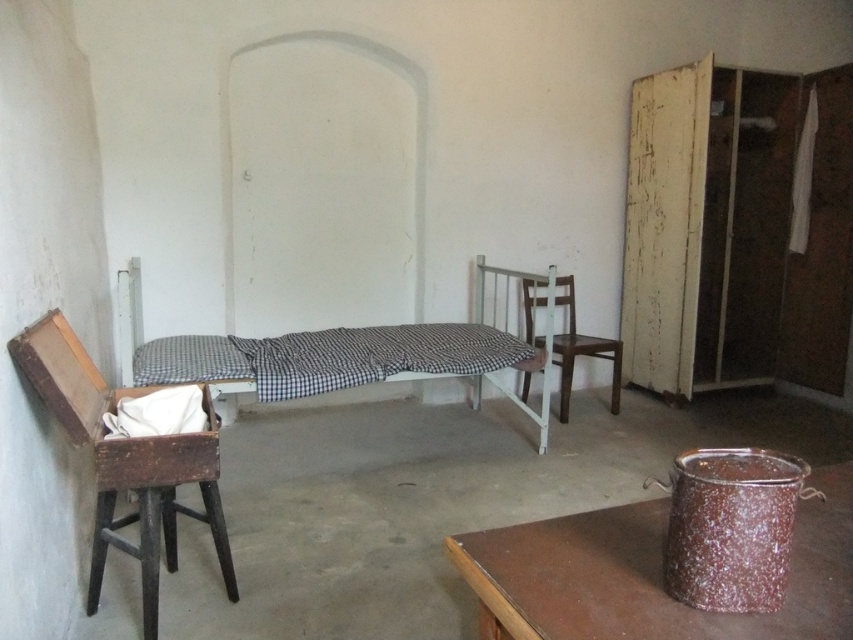
Question: Which point is closer to the camera?

Choices:
 (A) (206, 337)
 (B) (567, 412)
 (C) (483, 340)

Answer: (A)

Question: Which point is closer to the camera?

Choices:
 (A) wooden chair at left
 (B) white cotton pillow at center
 (C) brown wooden table at lower right

Answer: (C)

Question: Does checkered fabric bed at center appear over white cotton pillow at center?

Choices:
 (A) no
 (B) yes

Answer: (B)

Question: Is brown wooden table at lower right to the left of checkered fabric bed at center from the viewer's perspective?

Choices:
 (A) no
 (B) yes

Answer: (A)

Question: Which object appears farthest from the camera in this image?

Choices:
 (A) wooden chair at center
 (B) brown wooden table at lower right
 (C) checkered fabric bed at center

Answer: (A)

Question: Is checkered fabric bed at center bigger than white cotton pillow at center?

Choices:
 (A) yes
 (B) no

Answer: (A)